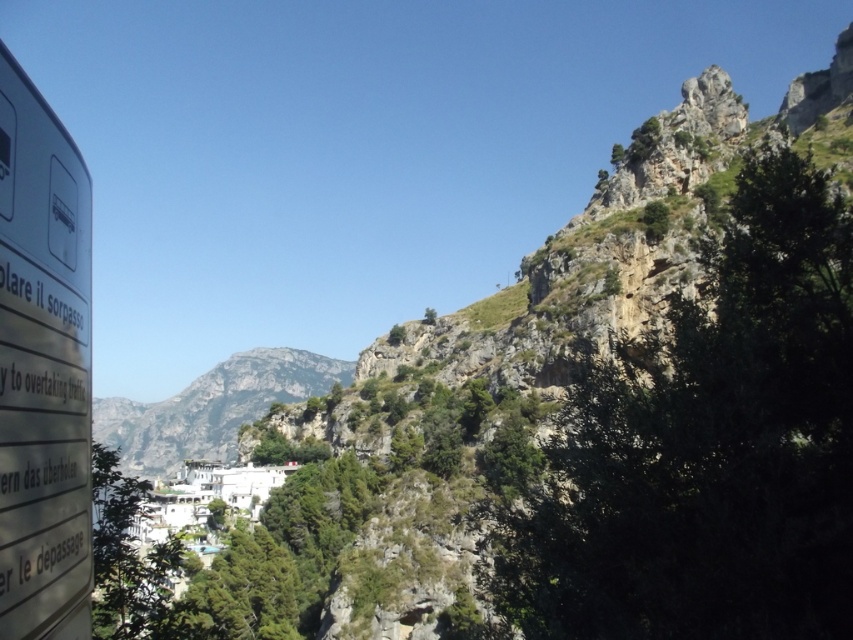
You are a hiker standing at the dense green foliage in the foreground. You see the white plastic sign at left and the gray rocky mountain at center. Which object is taller?

The gray rocky mountain at center is taller than the white plastic sign at left.

You are standing at the point labeled point (39,589) and want to take a photo of the village in the midground. Since you need to frame both the road sign and the village in your shot, will the point labeled point (310,387) be in front of or behind the village when you take the photo?

The point labeled point (39,589) is closer to the camera than point (310,387). Therefore, when taking the photo, the point labeled point (310,387) will be behind the village, while the point labeled point (39,589) will be in front.